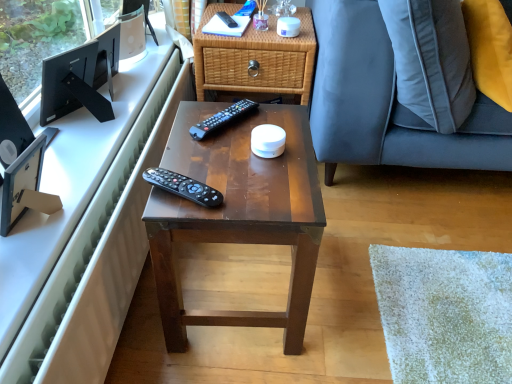
Question: Choose the correct answer: Is black plastic remote control at center, marked as the third remote control in a top-to-bottom arrangement, inside black plastic remote control at center, which appears as the second remote control when viewed from the front, or outside it?

Choices:
 (A) inside
 (B) outside

Answer: (B)

Question: Considering the positions of black plastic remote control at center, marked as the third remote control in a top-to-bottom arrangement, and black plastic remote control at center, which appears as the second remote control when viewed from the back, in the image, is black plastic remote control at center, marked as the third remote control in a top-to-bottom arrangement, wider or thinner than black plastic remote control at center, which appears as the second remote control when viewed from the back,?

Choices:
 (A) wide
 (B) thin

Answer: (A)

Question: Which is nearer to the woven wood nightstand at upper center?

Choices:
 (A) white glossy computer desk at upper left
 (B) black plastic remote control at center, which appears as the second remote control when viewed from the front
 (C) black plastic picture frame at left, which ranks as the first television in front-to-back order
 (D) black matte monitor at upper left, marked as the first television in a back-to-front arrangement
 (E) black plastic remote control at upper center, which appears as the 3th remote control when viewed from the front

Answer: (E)

Question: Which object is positioned closest to the white glossy computer desk at upper left?

Choices:
 (A) brown polished wood desk at center
 (B) black plastic remote control at upper center, which is the first remote control in back-to-front order
 (C) black plastic picture frame at left, the 2th television in the top-to-bottom sequence
 (D) black plastic remote control at center, which appears as the second remote control when viewed from the front
 (E) woven wood nightstand at upper center

Answer: (C)